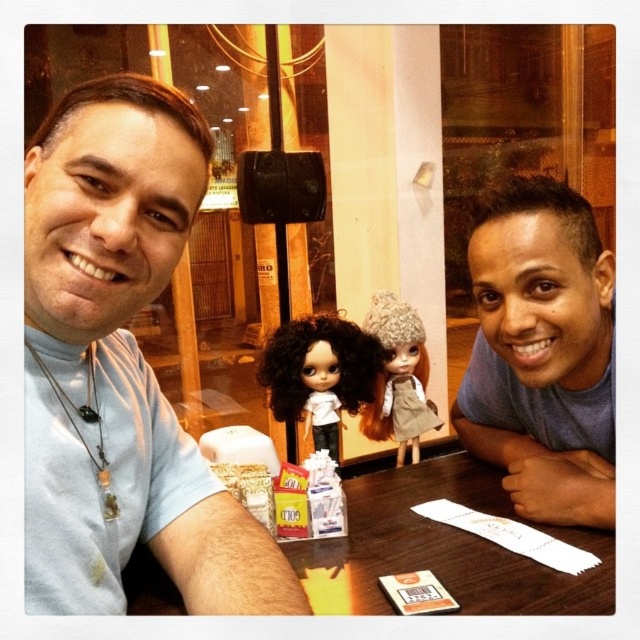
Is gray matte shirt at upper right below wooden table at center?

Actually, gray matte shirt at upper right is above wooden table at center.

Based on the photo, is the position of gray matte shirt at upper right more distant than that of wooden table at center?

Yes, it is behind wooden table at center.

Which is in front, point (540, 396) or point (600, 538)?

Point (600, 538) is in front.

Identify the location of gray matte shirt at upper right. (541, 353).

Is the position of gray matte shirt at upper right less distant than that of fuzzy beige hat at center?

Yes.

Which is behind, point (557, 416) or point (385, 312)?

The point (385, 312) is more distant.

Find the location of a particular element. The image size is (640, 640). gray matte shirt at upper right is located at coordinates (541, 353).

Describe the element at coordinates (134, 314) in the screenshot. The height and width of the screenshot is (640, 640). I see `light blue t-shirt at left` at that location.

Who is more forward, [225,582] or [412,419]?

Positioned in front is point [225,582].

The image size is (640, 640). I want to click on light blue t-shirt at left, so click(x=134, y=314).